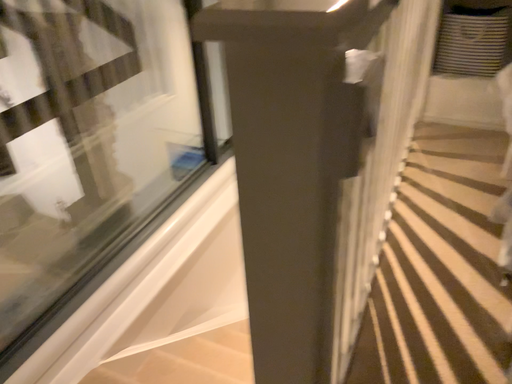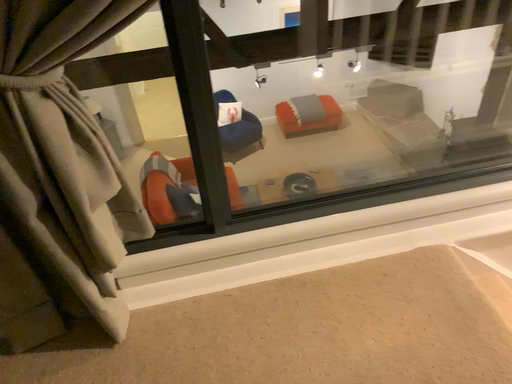
Question: Which way did the camera rotate in the video?

Choices:
 (A) rotated right
 (B) rotated left

Answer: (B)